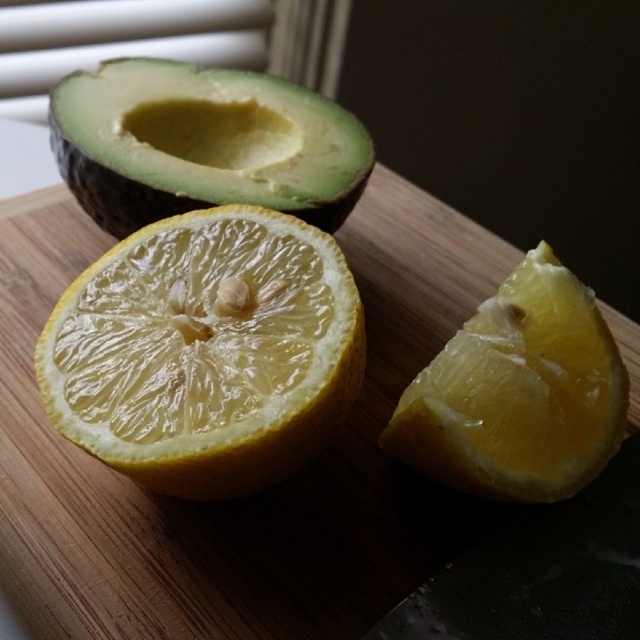
Question: Which point is closer to the camera taking this photo?

Choices:
 (A) (429, 228)
 (B) (132, 308)

Answer: (B)

Question: Is wooden cutting board at center behind green matte avocado at upper left?

Choices:
 (A) no
 (B) yes

Answer: (A)

Question: Which of the following is the closest to the observer?

Choices:
 (A) (477, 480)
 (B) (285, 177)

Answer: (A)

Question: Can you confirm if wooden cutting board at center is smaller than translucent yellow orange at center?

Choices:
 (A) no
 (B) yes

Answer: (A)

Question: Can you confirm if translucent yellow orange at center is positioned below yellow matte lemon at center?

Choices:
 (A) yes
 (B) no

Answer: (B)

Question: Which of the following is the farthest from the observer?

Choices:
 (A) translucent yellow orange at center
 (B) wooden cutting board at center
 (C) green matte avocado at upper left
 (D) yellow matte lemon at center

Answer: (C)